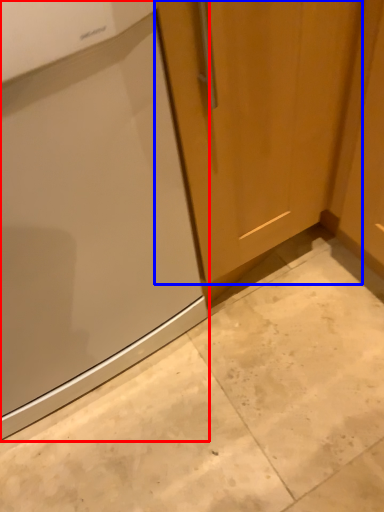
Question: Which point is closer to the camera, home appliance (highlighted by a red box) or door (highlighted by a blue box)?

Choices:
 (A) home appliance
 (B) door

Answer: (A)